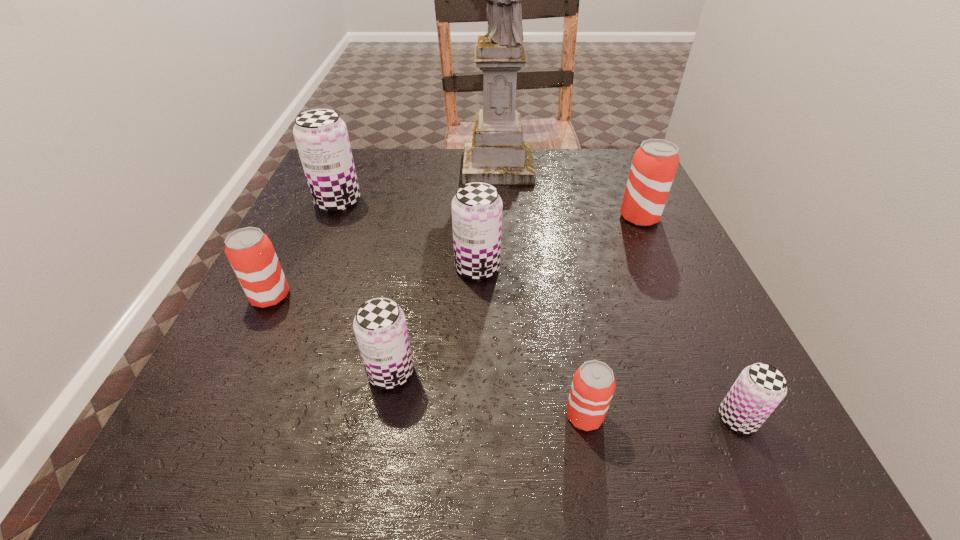
In the image, there is a desktop. In order to click on vacant space at the far edge in this screenshot , I will do `click(391, 175)`.

You are a GUI agent. You are given a task and a screenshot of the screen. Output one action in this format:
    pyautogui.click(x=<x>, y=<y>)
    Task: Click on the blank space at the near edge of the desktop
    Image resolution: width=960 pixels, height=540 pixels.
    Given the screenshot: What is the action you would take?
    pyautogui.click(x=666, y=484)

You are a GUI agent. You are given a task and a screenshot of the screen. Output one action in this format:
    pyautogui.click(x=<x>, y=<y>)
    Task: Click on the blank space at the left edge of the desktop
    The height and width of the screenshot is (540, 960).
    Given the screenshot: What is the action you would take?
    pyautogui.click(x=299, y=230)

I want to click on free region at the right edge of the desktop, so click(x=673, y=248).

The width and height of the screenshot is (960, 540). In order to click on vacant space at the near left corner of the desktop in this screenshot , I will do `click(258, 476)`.

The height and width of the screenshot is (540, 960). I want to click on free space at the far right corner of the desktop, so click(592, 155).

At what (x,y) coordinates should I click in order to perform the action: click on vacant region between the leftmost purple beer can and the sculpture. Please return your answer as a coordinate pair (x, y). The height and width of the screenshot is (540, 960). Looking at the image, I should click on (418, 184).

You are a GUI agent. You are given a task and a screenshot of the screen. Output one action in this format:
    pyautogui.click(x=<x>, y=<y>)
    Task: Click on the free area in between the fifth beer can from right to left and the smallest orange beer can
    The image size is (960, 540).
    Given the screenshot: What is the action you would take?
    pyautogui.click(x=488, y=394)

At what (x,y) coordinates should I click in order to perform the action: click on empty location between the second nearest orange beer can and the third smallest purple beer can. Please return your answer as a coordinate pair (x, y). Looking at the image, I should click on (373, 282).

Identify the location of free space between the rightmost purple beer can and the second biggest orange beer can. (504, 357).